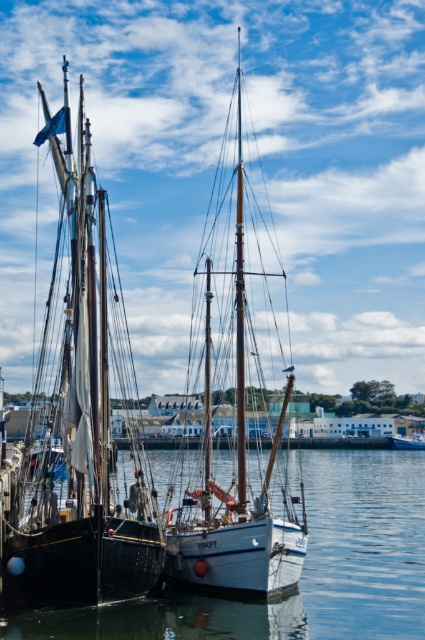
You are a harbor security officer checking the coordinates of the boats. According to the system, the coordinates of the matte black sailboat at left are at point (79, 417). Where is the matte black sailboat at left located in the harbor?

The matte black sailboat at left is located at point (79, 417).

You are standing on the dock and want to take a photo of the clear water at center. Where should you aim your camera to capture it?

You should aim your camera at point [303,568] to capture the clear water at center.